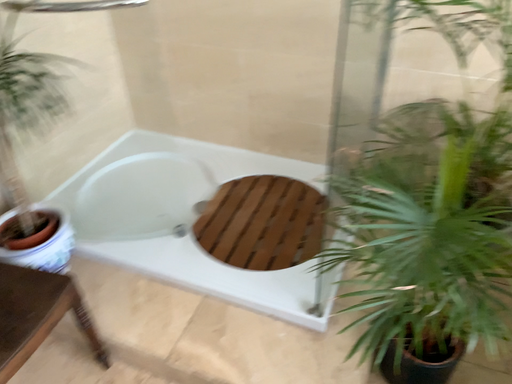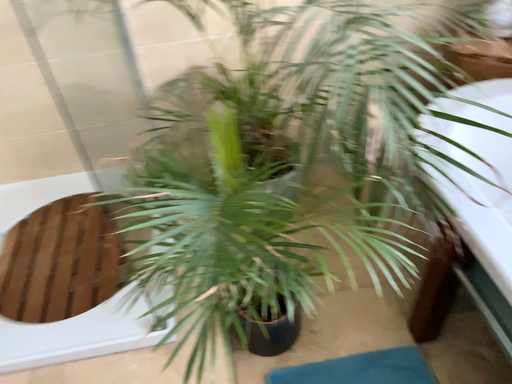
Question: Which way did the camera rotate in the video?

Choices:
 (A) rotated right
 (B) rotated left

Answer: (A)